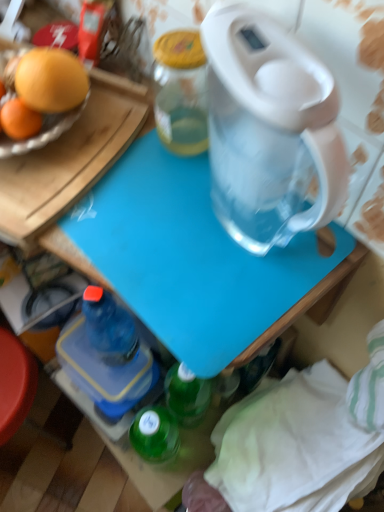
Question: In the image, is blue plastic bottle at lower left positioned in front of or behind blue plastic cutting board at center?

Choices:
 (A) behind
 (B) front

Answer: (A)

Question: Does point (82, 309) appear closer or farther from the camera than point (193, 219)?

Choices:
 (A) farther
 (B) closer

Answer: (A)

Question: Is blue plastic bottle at lower left spatially inside blue plastic cutting board at center, or outside of it?

Choices:
 (A) outside
 (B) inside

Answer: (A)

Question: From the image's perspective, is blue plastic cutting board at center positioned above or below blue plastic bottle at lower left?

Choices:
 (A) above
 (B) below

Answer: (A)

Question: In terms of size, does blue plastic cutting board at center appear bigger or smaller than blue plastic bottle at lower left?

Choices:
 (A) small
 (B) big

Answer: (B)

Question: In the image, is blue plastic cutting board at center on the left side or the right side of blue plastic bottle at lower left?

Choices:
 (A) left
 (B) right

Answer: (B)

Question: Relative to blue plastic bottle at lower left, is blue plastic cutting board at center in front or behind?

Choices:
 (A) front
 (B) behind

Answer: (A)